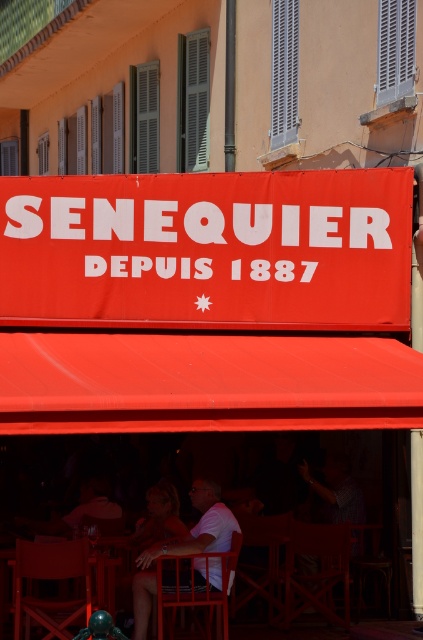
Question: Does red fabric sign at center appear on the right side of matte white shirt at lower left?

Choices:
 (A) yes
 (B) no

Answer: (A)

Question: In this image, where is red fabric sign at center located relative to matte red shirt at center?

Choices:
 (A) below
 (B) above

Answer: (B)

Question: Does red fabric sign at center have a smaller size compared to white cotton shirt at center?

Choices:
 (A) yes
 (B) no

Answer: (B)

Question: Estimate the real-world distances between objects in this image. Which object is farther from the matte red shirt at center?

Choices:
 (A) white cotton shirt at center
 (B) matte white shirt at lower left
 (C) red fabric sign at center

Answer: (C)

Question: Among these objects, which one is farthest from the camera?

Choices:
 (A) matte white shirt at lower left
 (B) matte red shirt at center
 (C) white cotton shirt at center

Answer: (A)

Question: Estimate the real-world distances between objects in this image. Which object is farther from the matte white shirt at lower left?

Choices:
 (A) red fabric sign at center
 (B) white cotton shirt at center
 (C) matte red shirt at center

Answer: (A)